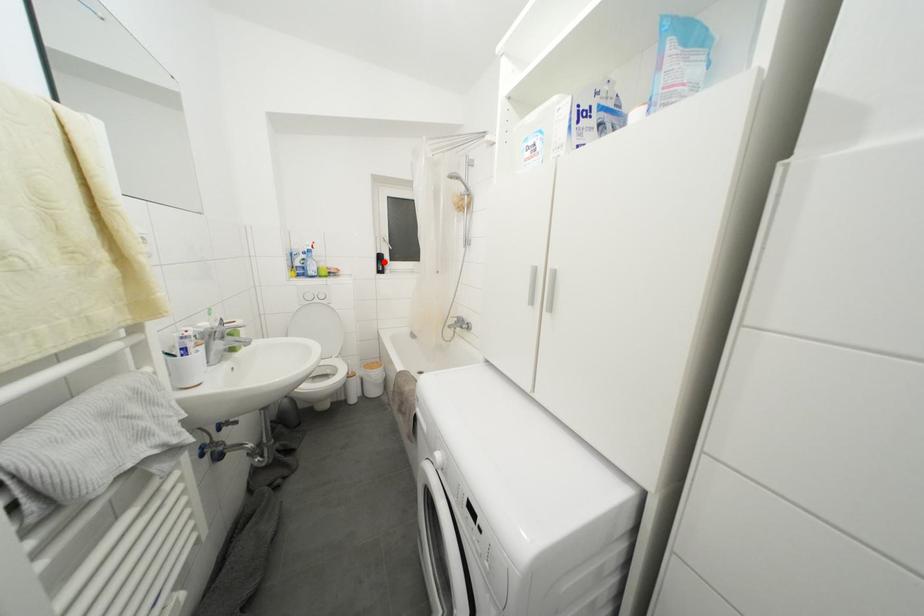
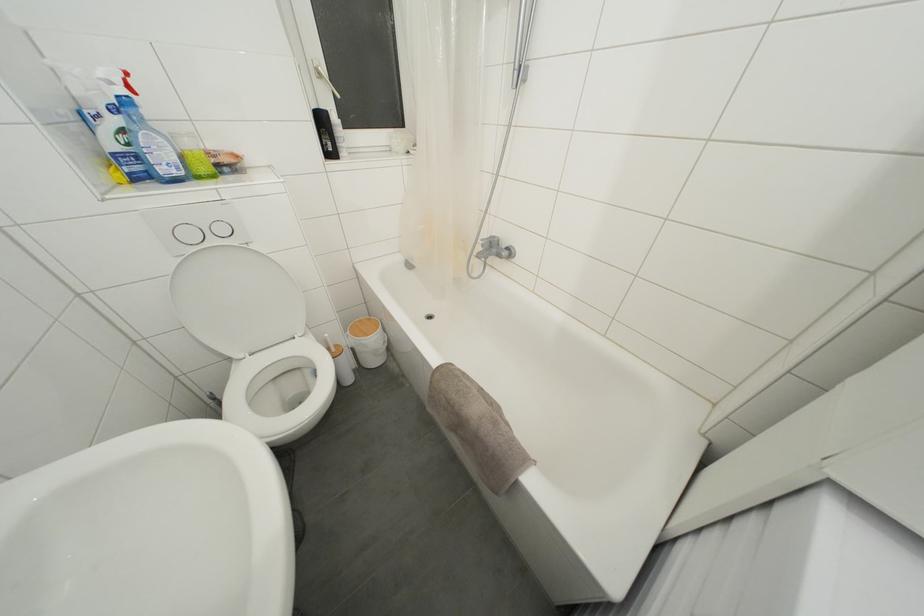
Locate, in the second image, the point that corresponds to the highlighted location in the first image.

(325, 126)